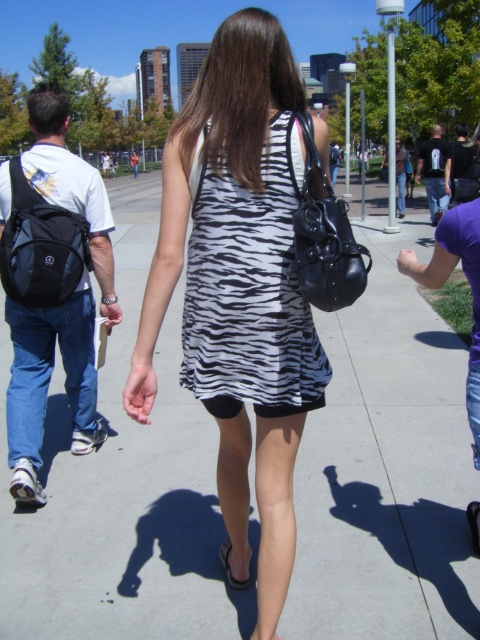
Does matte concrete sidewalk at center appear on the left side of zebra-patterned dress at center?

Correct, you'll find matte concrete sidewalk at center to the left of zebra-patterned dress at center.

Who is positioned more to the right, matte concrete sidewalk at center or zebra-patterned dress at center?

From the viewer's perspective, zebra-patterned dress at center appears more on the right side.

Does point (178, 298) come in front of point (156, 301)?

No.

The height and width of the screenshot is (640, 480). In order to click on matte concrete sidewalk at center in this screenshot , I will do `click(386, 468)`.

Between point (202, 273) and point (29, 401), which one is positioned in front?

Positioned in front is point (202, 273).

Between zebra-patterned dress at center and black fabric backpack at left, which one has more height?

With more height is zebra-patterned dress at center.

The image size is (480, 640). What do you see at coordinates (238, 289) in the screenshot?
I see `zebra-patterned dress at center` at bounding box center [238, 289].

The image size is (480, 640). I want to click on zebra-patterned dress at center, so click(x=238, y=289).

Looking at this image, between black rubber sandal at lower center and black synthetic sandal at lower center, which one is positioned lower?

black rubber sandal at lower center is lower down.

Locate an element on the screen. The image size is (480, 640). black rubber sandal at lower center is located at coordinates (229, 566).